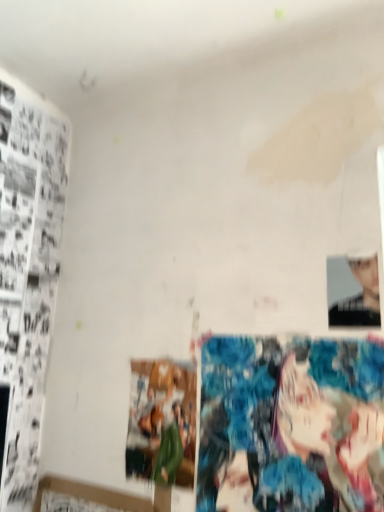
Question: Considering the relative sizes of matte paper print at center and smooth black portrait at upper right in the image provided, is matte paper print at center taller than smooth black portrait at upper right?

Choices:
 (A) yes
 (B) no

Answer: (A)

Question: Is matte paper print at center beside smooth black portrait at upper right?

Choices:
 (A) no
 (B) yes

Answer: (A)

Question: Considering the relative sizes of matte paper print at center and smooth black portrait at upper right in the image provided, is matte paper print at center smaller than smooth black portrait at upper right?

Choices:
 (A) yes
 (B) no

Answer: (B)

Question: From the image's perspective, would you say matte paper print at center is positioned over smooth black portrait at upper right?

Choices:
 (A) no
 (B) yes

Answer: (A)

Question: From a real-world perspective, is matte paper print at center physically above smooth black portrait at upper right?

Choices:
 (A) no
 (B) yes

Answer: (A)

Question: From a real-world perspective, is matte paper print at center located beneath smooth black portrait at upper right?

Choices:
 (A) no
 (B) yes

Answer: (B)

Question: Is smooth black portrait at upper right positioned with its back to colorful fabric art at lower right?

Choices:
 (A) no
 (B) yes

Answer: (A)

Question: Are smooth black portrait at upper right and colorful fabric art at lower right beside each other?

Choices:
 (A) yes
 (B) no

Answer: (B)

Question: Is smooth black portrait at upper right oriented towards colorful fabric art at lower right?

Choices:
 (A) no
 (B) yes

Answer: (A)

Question: Can you confirm if smooth black portrait at upper right is positioned to the left of colorful fabric art at lower right?

Choices:
 (A) yes
 (B) no

Answer: (B)

Question: From a real-world perspective, is smooth black portrait at upper right below colorful fabric art at lower right?

Choices:
 (A) no
 (B) yes

Answer: (A)

Question: Is smooth black portrait at upper right taller than colorful fabric art at lower right?

Choices:
 (A) yes
 (B) no

Answer: (B)

Question: Does smooth black portrait at upper right have a lesser width compared to matte paper print at center?

Choices:
 (A) yes
 (B) no

Answer: (A)